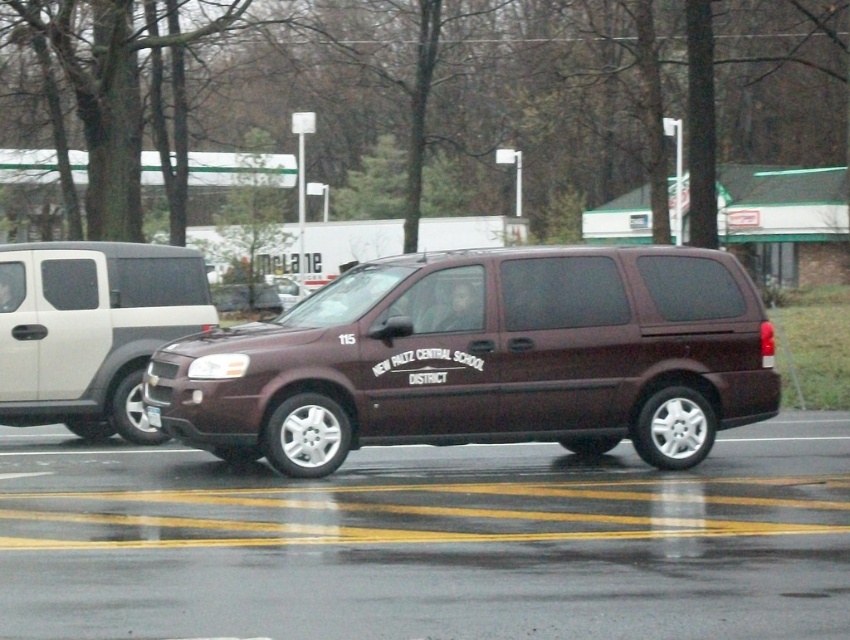
Question: Estimate the real-world distances between objects in this image. Which object is farther from the matte black van at center?

Choices:
 (A) matte white suv at left
 (B) black matte license plate at center
 (C) satin dark brown minivan at center

Answer: (B)

Question: Does satin dark brown minivan at center have a larger size compared to black matte license plate at center?

Choices:
 (A) yes
 (B) no

Answer: (A)

Question: Does matte white suv at left appear over black matte license plate at center?

Choices:
 (A) no
 (B) yes

Answer: (B)

Question: Which point appears farthest from the camera in this image?

Choices:
 (A) (310, 244)
 (B) (246, 346)

Answer: (A)

Question: Can you confirm if matte black van at center is wider than black matte license plate at center?

Choices:
 (A) yes
 (B) no

Answer: (A)

Question: Which point is closer to the camera?

Choices:
 (A) (156, 419)
 (B) (208, 230)

Answer: (A)